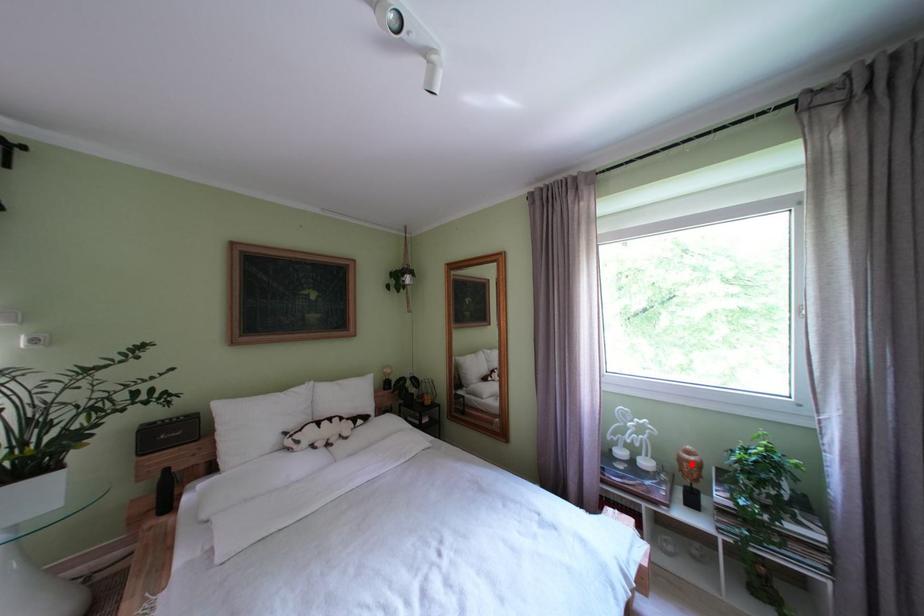
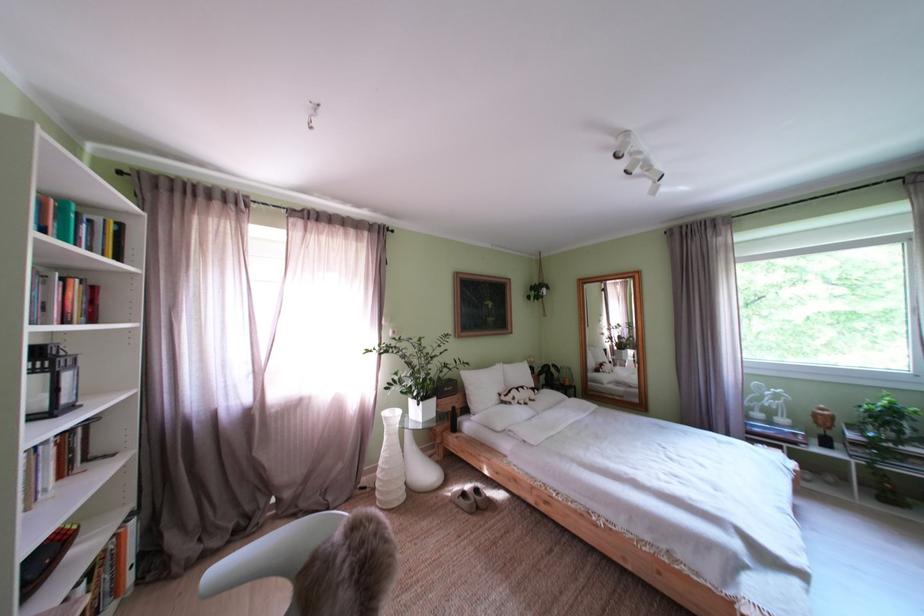
Question: I am providing you with two images of the same scene from different viewpoints. A red point is marked on the first image. At the location where the point appears in image 1, is it still visible in image 2?

Choices:
 (A) Yes
 (B) No

Answer: (A)